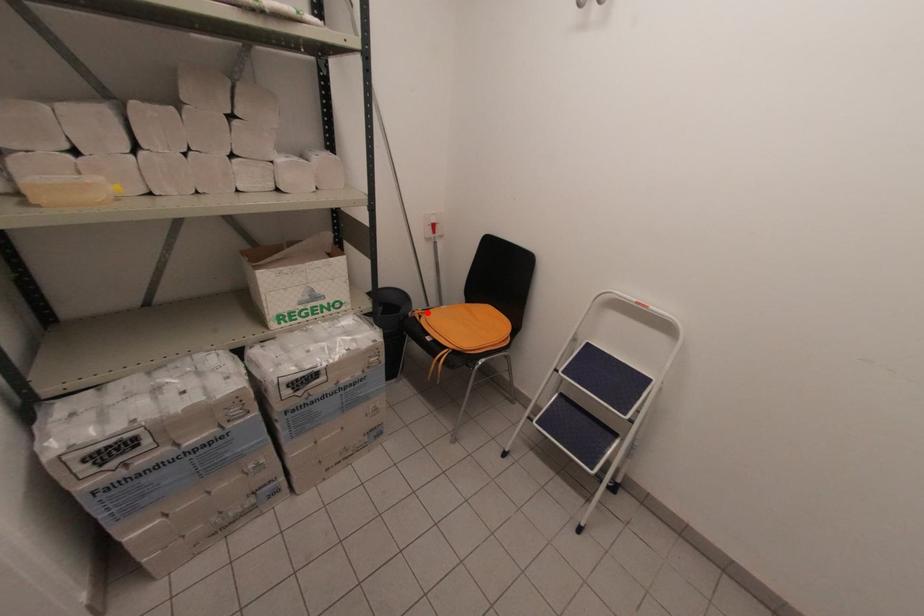
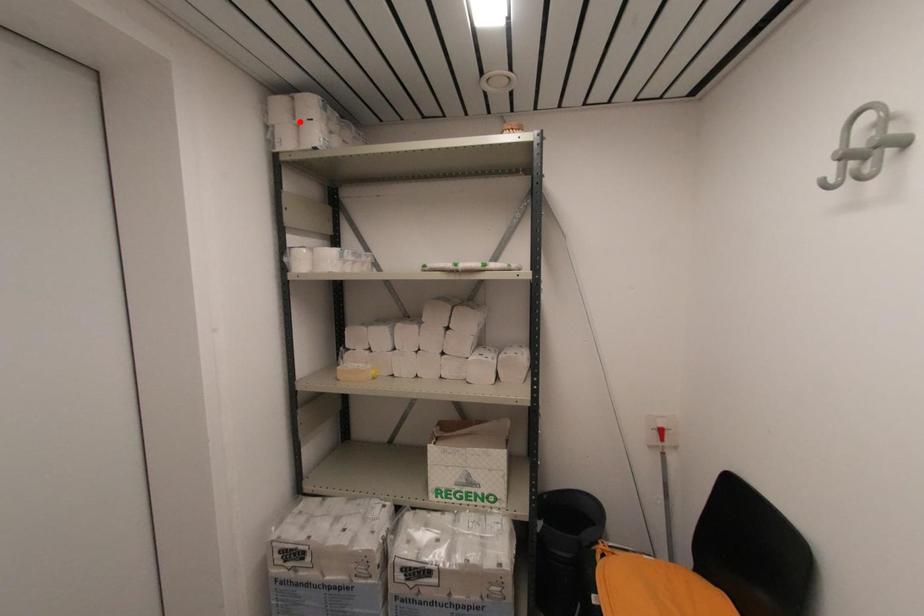
I am providing you with two images of the same scene from different viewpoints. A red point is marked on the first image and another point is marked on the second image. Is the red point in image1 aligned with the point shown in image2?

No